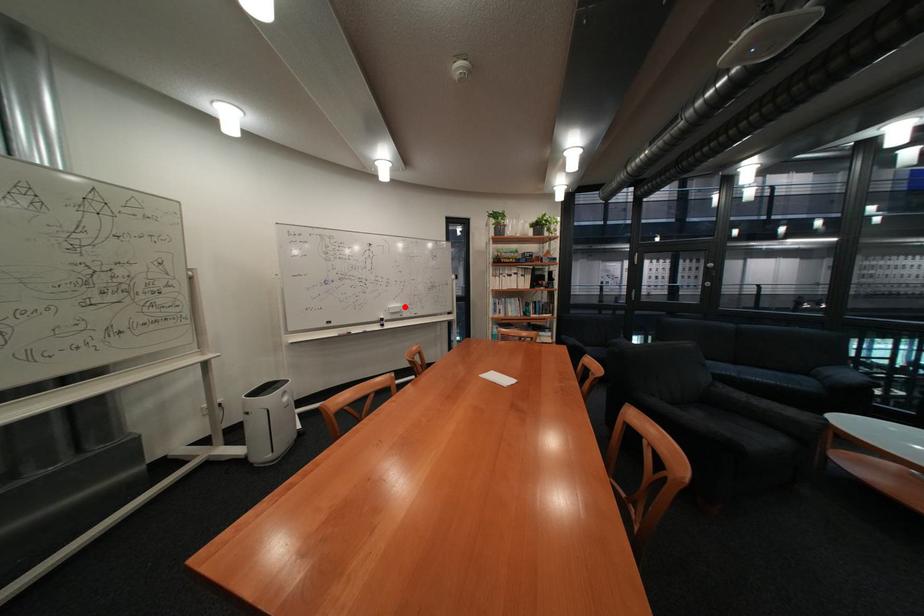
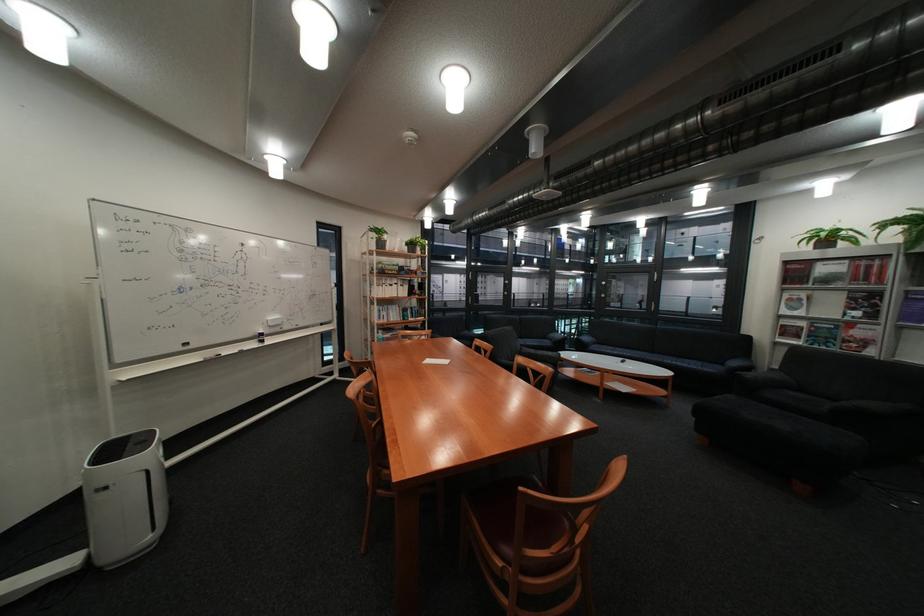
Question: I am providing you with two images of the same scene from different viewpoints. A red point is marked on the first image. At the location where the point appears in image 1, is it still visible in image 2?

Choices:
 (A) Yes
 (B) No

Answer: (A)